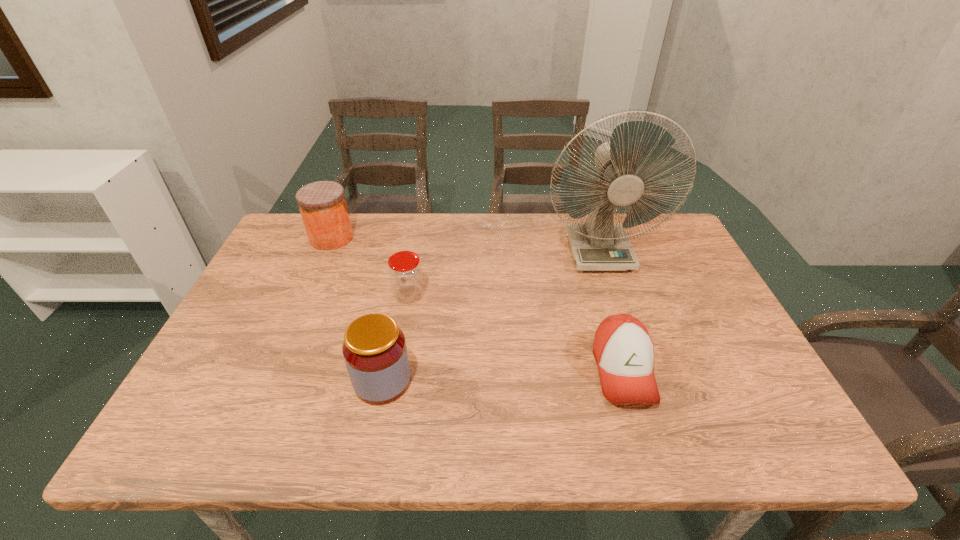
Image resolution: width=960 pixels, height=540 pixels. Identify the location of free space located on the right of the third farthest object. (564, 295).

Identify the location of fan located in the far edge section of the desktop. This screenshot has height=540, width=960. (598, 244).

The width and height of the screenshot is (960, 540). What are the coordinates of `jar that is at the far edge` in the screenshot? It's located at (323, 207).

Where is `object present at the near edge`? The height and width of the screenshot is (540, 960). object present at the near edge is located at coordinates (624, 351).

The height and width of the screenshot is (540, 960). Identify the location of object present at the left edge. (323, 207).

Find the location of a particular element. object positioned at the right edge is located at coordinates (598, 244).

This screenshot has width=960, height=540. What are the coordinates of `object that is positioned at the far left corner` in the screenshot? It's located at (323, 207).

The width and height of the screenshot is (960, 540). In order to click on object present at the far right corner in this screenshot , I will do `click(598, 244)`.

Where is `free region at the far edge`? free region at the far edge is located at coordinates (501, 216).

Where is `vacant space at the near edge of the desktop`? vacant space at the near edge of the desktop is located at coordinates (486, 423).